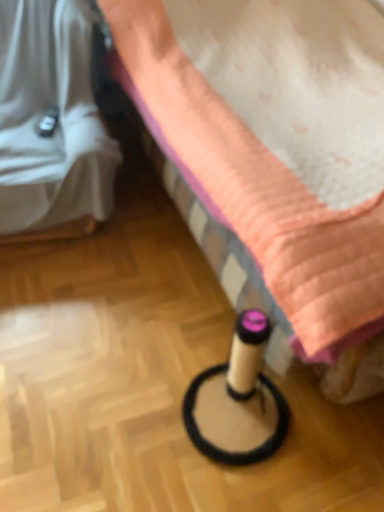
Question: Should I look upward or downward to see white fabric at left, the first furniture from the left?

Choices:
 (A) up
 (B) down

Answer: (A)

Question: Should I look upward or downward to see beige cardboard tube at lower center, positioned as the second furniture in left-to-right order?

Choices:
 (A) up
 (B) down

Answer: (A)

Question: Is white fabric at left, the first furniture from the left, bigger than beige cardboard tube at lower center, which appears as the 1th furniture when viewed from the right?

Choices:
 (A) yes
 (B) no

Answer: (B)

Question: Can you confirm if white fabric at left, the 2th furniture viewed from the right, is positioned to the right of beige cardboard tube at lower center, which appears as the 1th furniture when viewed from the right?

Choices:
 (A) yes
 (B) no

Answer: (B)

Question: Could beige cardboard tube at lower center, which appears as the 1th furniture when viewed from the right, be considered to be inside white fabric at left, the first furniture from the left?

Choices:
 (A) yes
 (B) no

Answer: (B)

Question: Is white fabric at left, the first furniture from the left, thinner than beige cardboard tube at lower center, which appears as the 1th furniture when viewed from the right?

Choices:
 (A) yes
 (B) no

Answer: (A)

Question: Could you tell me if white fabric at left, the 2th furniture viewed from the right, is turned towards beige cardboard tube at lower center, which appears as the 1th furniture when viewed from the right?

Choices:
 (A) no
 (B) yes

Answer: (A)

Question: Can you confirm if white fabric at left, the first furniture from the left, is smaller than beige cardboard tube at lower center, which appears as the 1th furniture when viewed from the right?

Choices:
 (A) no
 (B) yes

Answer: (B)

Question: Can you confirm if beige cardboard tube at lower center, positioned as the second furniture in left-to-right order, is smaller than white fabric at left, the 2th furniture viewed from the right?

Choices:
 (A) no
 (B) yes

Answer: (A)

Question: Is the depth of beige cardboard tube at lower center, positioned as the second furniture in left-to-right order, less than that of white fabric at left, the 2th furniture viewed from the right?

Choices:
 (A) yes
 (B) no

Answer: (A)

Question: Is beige cardboard tube at lower center, positioned as the second furniture in left-to-right order, aimed at white fabric at left, the 2th furniture viewed from the right?

Choices:
 (A) yes
 (B) no

Answer: (A)

Question: Is beige cardboard tube at lower center, positioned as the second furniture in left-to-right order, in contact with white fabric at left, the 2th furniture viewed from the right?

Choices:
 (A) no
 (B) yes

Answer: (A)

Question: From the image's perspective, is beige cardboard tube at lower center, which appears as the 1th furniture when viewed from the right, on white fabric at left, the 2th furniture viewed from the right?

Choices:
 (A) yes
 (B) no

Answer: (B)

Question: Is beige cardboard tube at lower center, which appears as the 1th furniture when viewed from the right, facing away from white fabric at left, the first furniture from the left?

Choices:
 (A) no
 (B) yes

Answer: (A)

Question: Considering the positions of point (36, 160) and point (334, 216), is point (36, 160) closer or farther from the camera than point (334, 216)?

Choices:
 (A) farther
 (B) closer

Answer: (A)